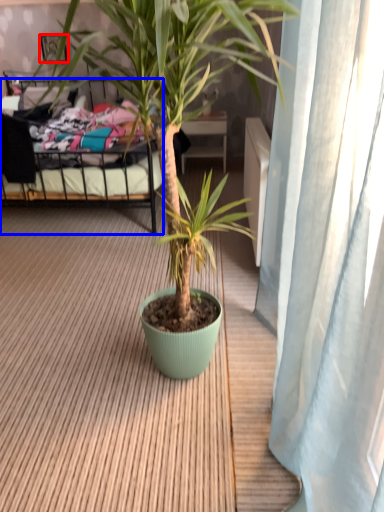
Question: Which object appears farthest to the camera in this image, picture frame (highlighted by a red box) or bed (highlighted by a blue box)?

Choices:
 (A) picture frame
 (B) bed

Answer: (A)